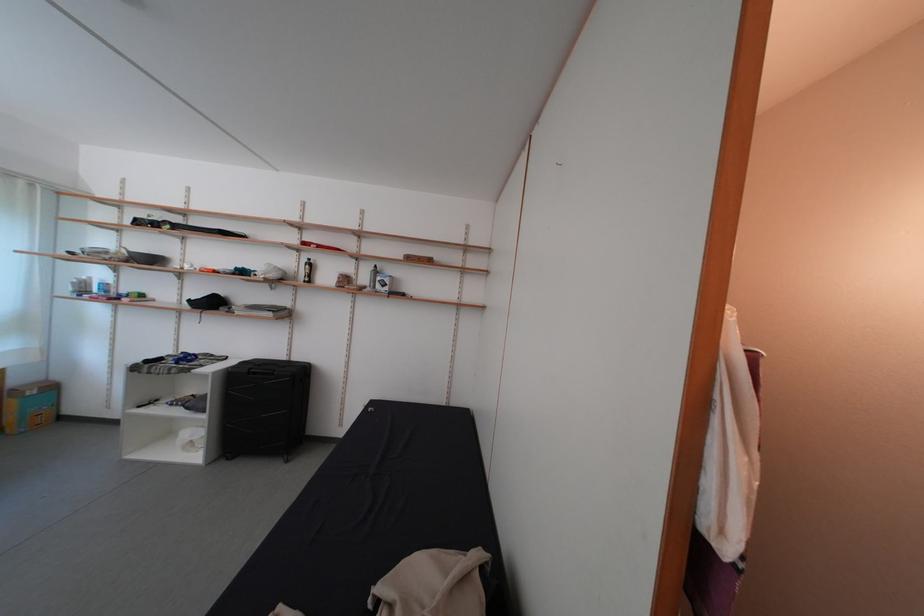
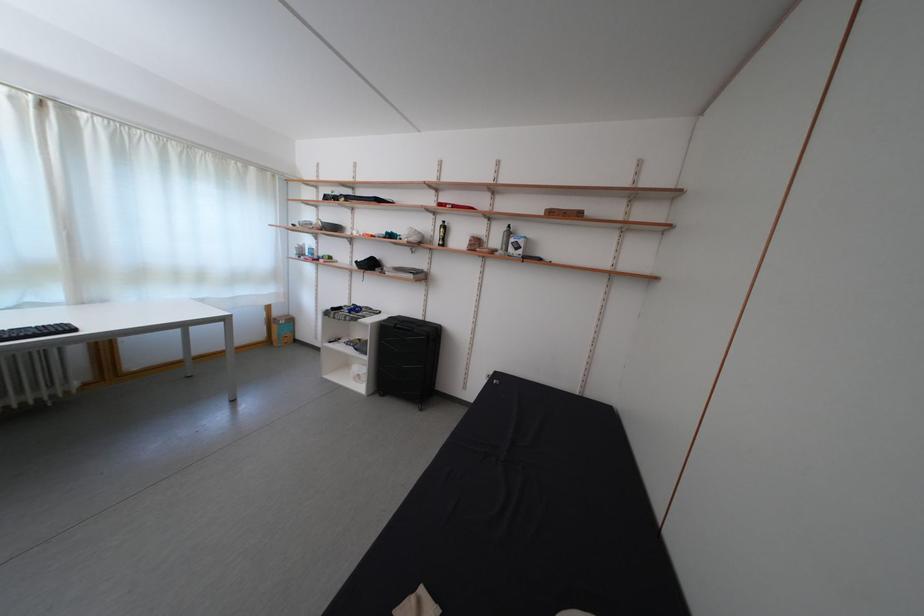
Find the pixel in the second image that matches (307,278) in the first image.

(442, 241)